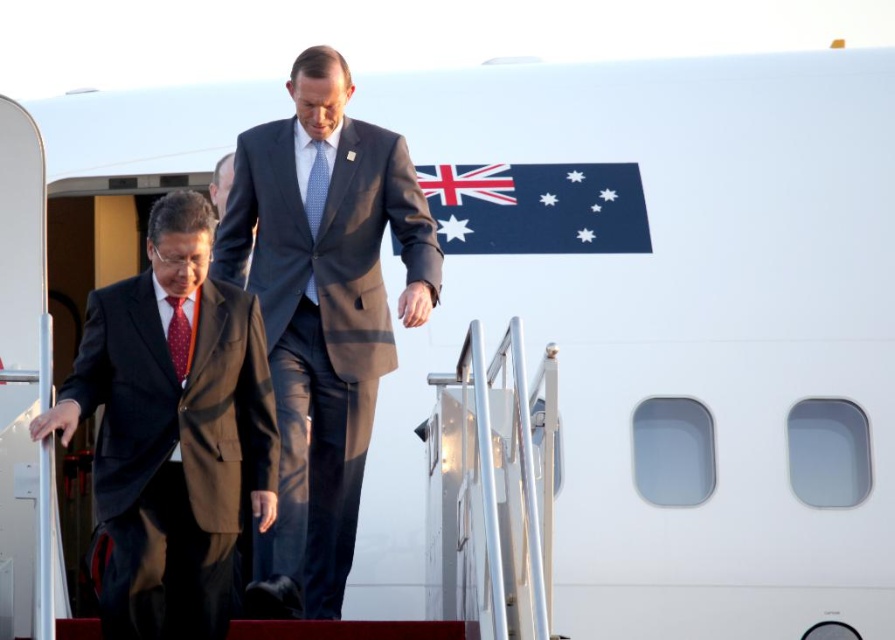
Is blue dotted fabric tie at center above red dotted tie at left?

Yes.

Can you confirm if blue dotted fabric tie at center is smaller than red dotted tie at left?

No, blue dotted fabric tie at center is not smaller than red dotted tie at left.

Is point (316, 234) positioned in front of point (188, 355)?

That is False.

The height and width of the screenshot is (640, 895). Find the location of `blue dotted fabric tie at center`. blue dotted fabric tie at center is located at coordinates (316, 188).

Based on the photo, between dark blue suit at center and red dotted tie at left, which one is positioned higher?

red dotted tie at left

Image resolution: width=895 pixels, height=640 pixels. What do you see at coordinates (322, 317) in the screenshot?
I see `dark blue suit at center` at bounding box center [322, 317].

Identify the location of dark blue suit at center. This screenshot has width=895, height=640. (322, 317).

Who is shorter, matte black suit at left or blue dotted fabric tie at center?

blue dotted fabric tie at center

Is point (224, 624) positioned before point (320, 157)?

Yes.

Where is `matte black suit at left`? Image resolution: width=895 pixels, height=640 pixels. matte black suit at left is located at coordinates (172, 433).